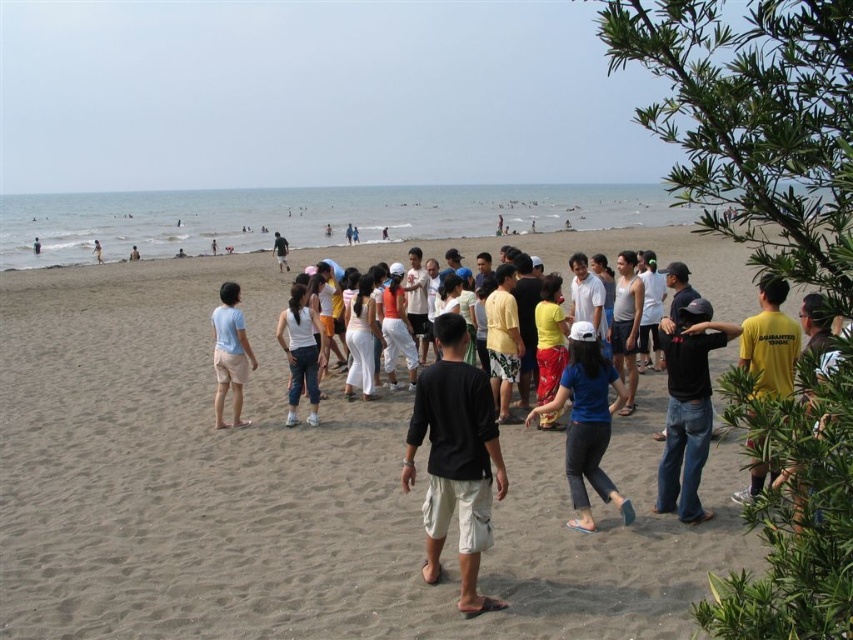
Looking at this image, you are a photographer trying to capture a group photo of the blue fabric shirt at center and the white cotton shirt at center. Since you want to ensure both are clearly visible, which one should you focus on first to account for their sizes?

The blue fabric shirt at center is bigger than the white cotton shirt at center, so you should focus on the blue fabric shirt at center first to ensure it is clearly visible, as its larger size may require more attention in framing.

You are a photographer trying to capture a photo of the group of people at the beach. You notice two shirts in the front row, a blue fabric shirt at center and a white cotton shirt at center. Which shirt is blocking the view of the other?

The blue fabric shirt at center is in front of the white cotton shirt at center, so it is blocking the view of the white cotton shirt at center.

You are a photographer at the beach scene. You need to capture a photo where both the light blue fabric at center and the light blue jeans at center are visible. Which object should you focus on to ensure both are in frame without moving the camera?

You should focus on the light blue jeans at center because it occupies more space and will be easier to keep both objects in frame.